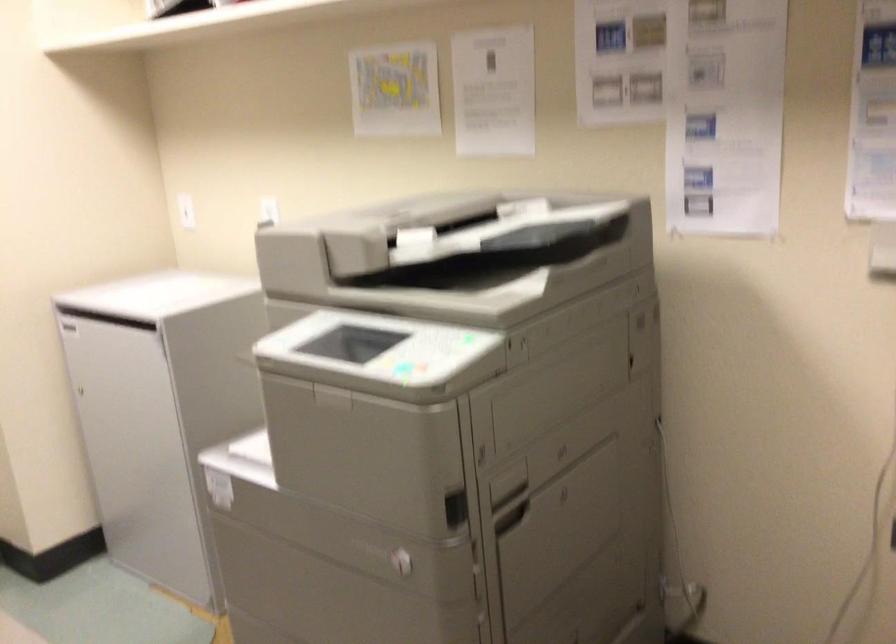
What are the coordinates of `green printer button` in the screenshot? It's located at pyautogui.click(x=401, y=368).